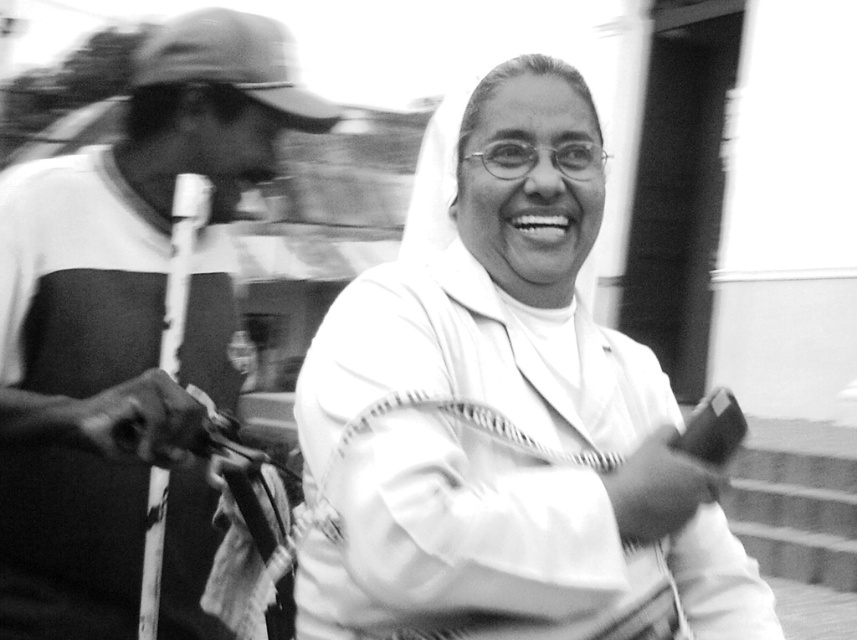
Question: Which point is closer to the camera?

Choices:
 (A) (226, 196)
 (B) (765, 612)

Answer: (B)

Question: Which point is farther to the camera?

Choices:
 (A) white matte nun's habit at center
 (B) smooth fabric shirt at left

Answer: (B)

Question: Which point is farther from the camera taking this photo?

Choices:
 (A) (67, 568)
 (B) (394, 273)

Answer: (A)

Question: Is the position of white matte nun's habit at center less distant than that of smooth fabric shirt at left?

Choices:
 (A) yes
 (B) no

Answer: (A)

Question: Can you confirm if white matte nun's habit at center is wider than smooth fabric shirt at left?

Choices:
 (A) no
 (B) yes

Answer: (B)

Question: Does white matte nun's habit at center appear on the left side of smooth fabric shirt at left?

Choices:
 (A) yes
 (B) no

Answer: (B)